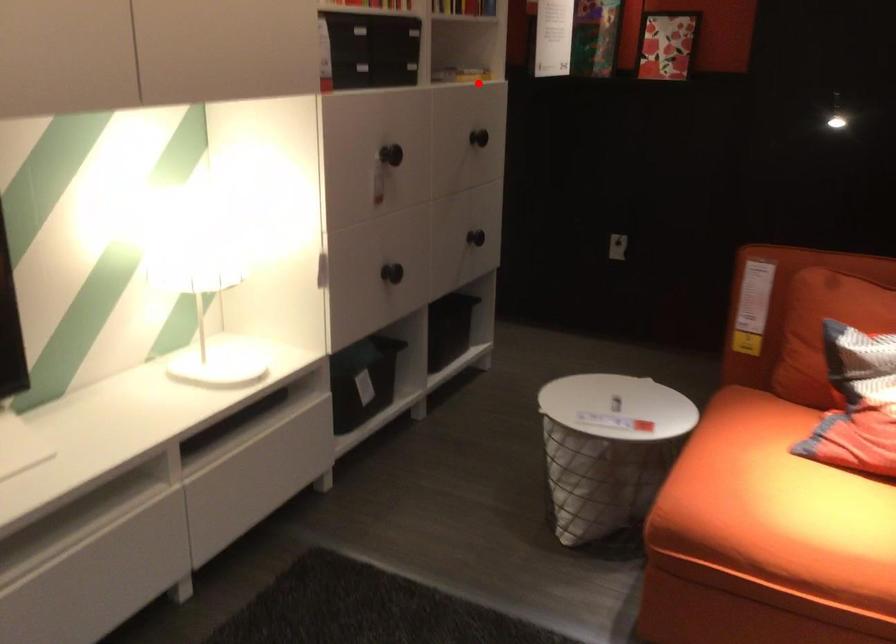
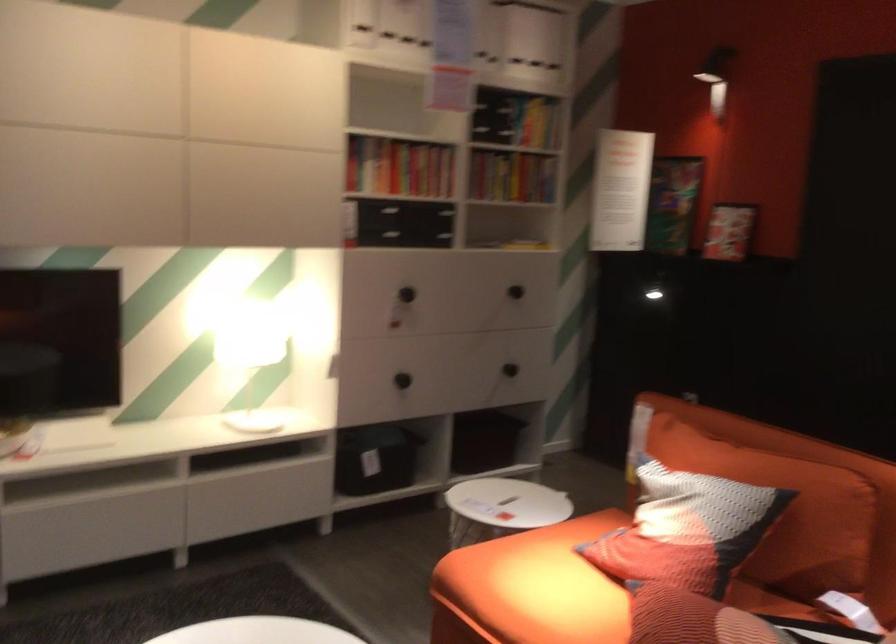
In the second image, find the point that corresponds to the highlighted location in the first image.

(524, 245)